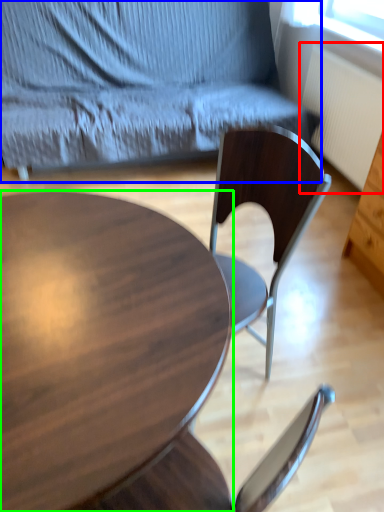
Question: Estimate the real-world distances between objects in this image. Which object is farther from radiator (highlighted by a red box), chair (highlighted by a blue box) or coffee table (highlighted by a green box)?

Choices:
 (A) chair
 (B) coffee table

Answer: (B)